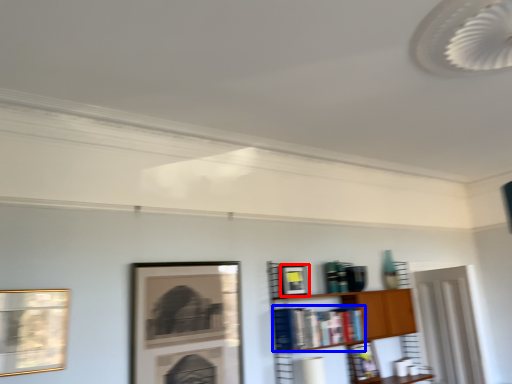
Question: Which object is further to the camera taking this photo, picture frame (highlighted by a red box) or book (highlighted by a blue box)?

Choices:
 (A) picture frame
 (B) book

Answer: (A)